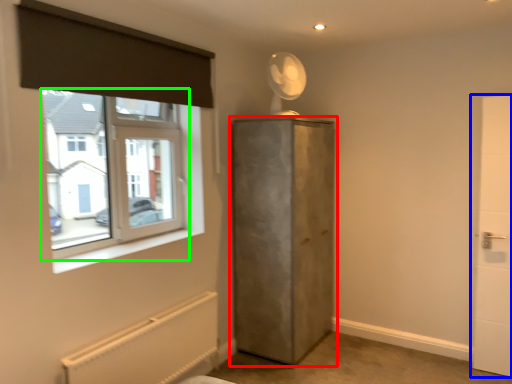
Question: Estimate the real-world distances between objects in this image. Which object is closer to door (highlighted by a red box), door (highlighted by a blue box) or window (highlighted by a green box)?

Choices:
 (A) door
 (B) window

Answer: (B)